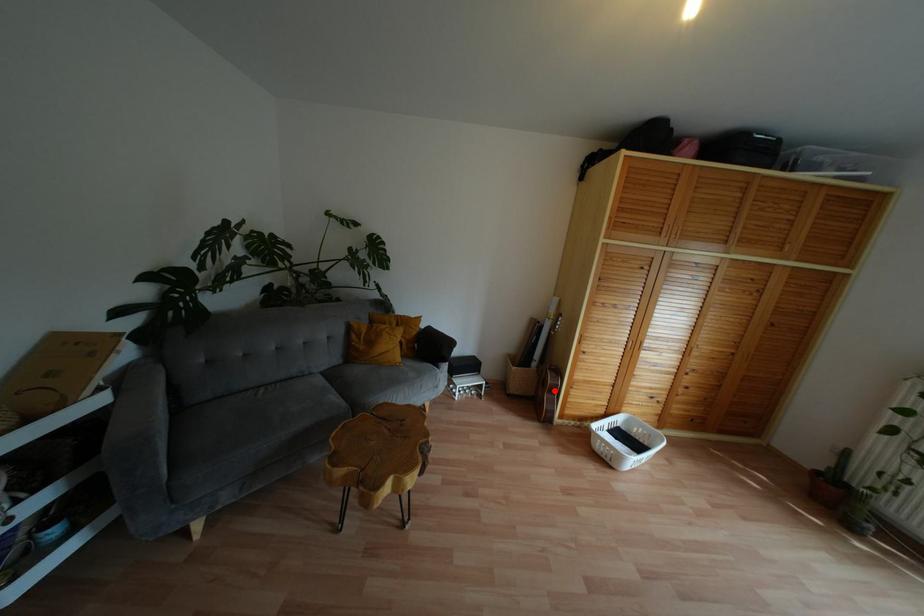
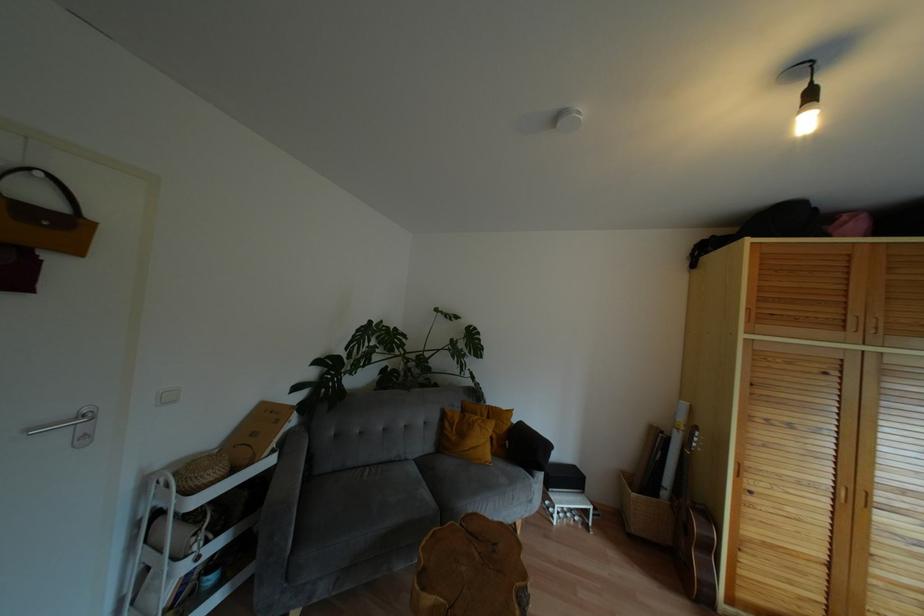
Question: I am providing you with two images of the same scene from different viewpoints. In image1, a red point is highlighted. Considering the same 3D point in image2, which of the following is correct?

Choices:
 (A) It is closer
 (B) It is farther

Answer: (A)